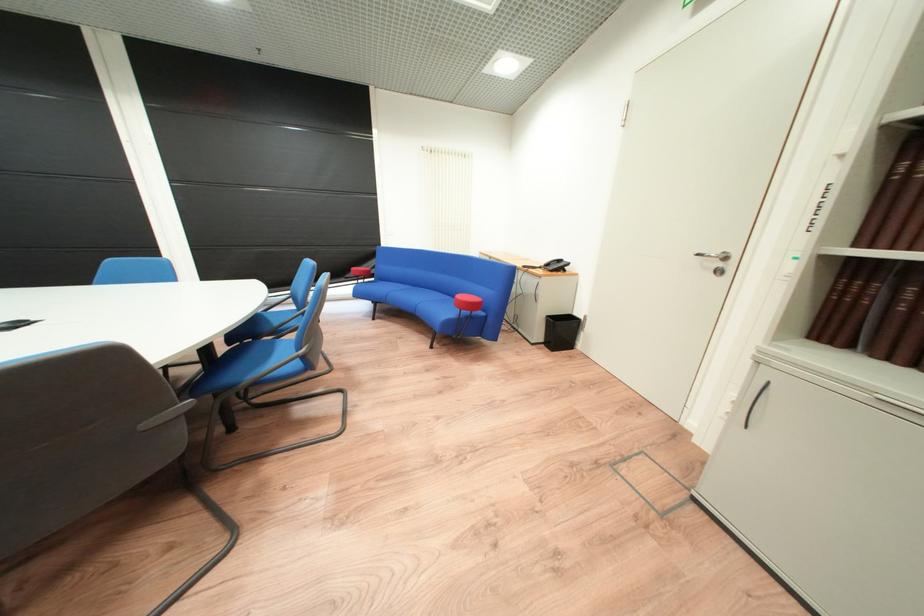
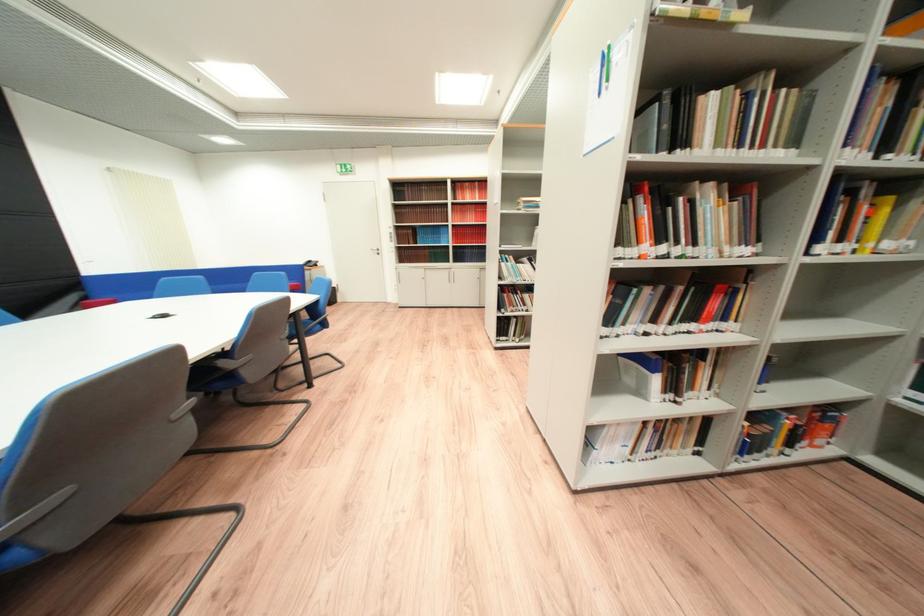
The point at (x=730, y=273) is marked in the first image. Where is the corresponding point in the second image?

(388, 254)